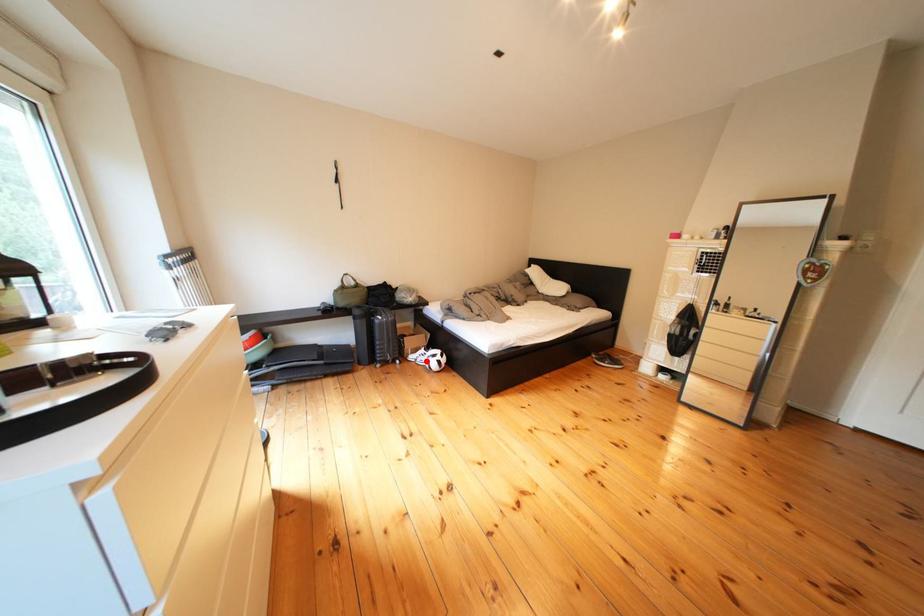
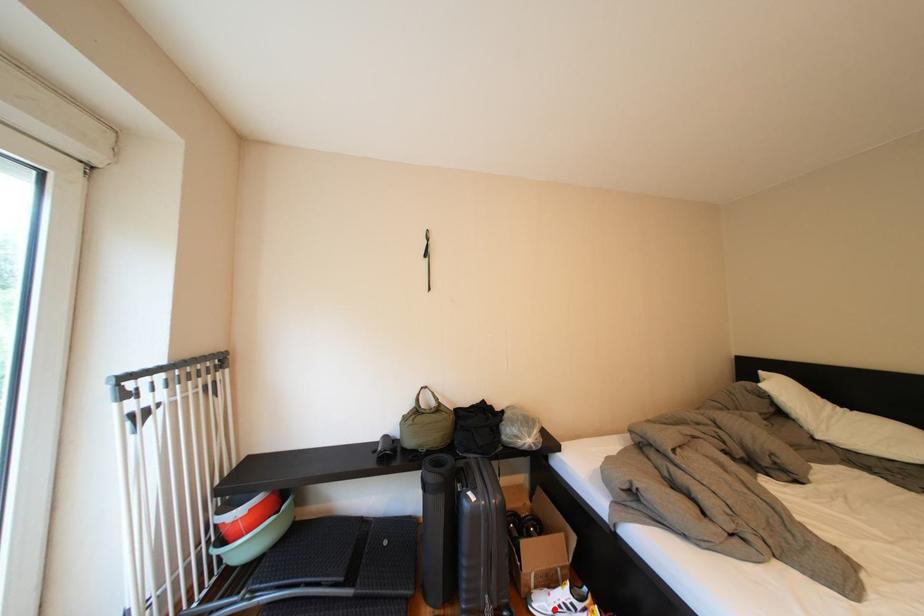
I am providing you with two images of the same scene from different viewpoints. A red point is marked on the first image and another point is marked on the second image. Do the highlighted points in image1 and image2 indicate the same real-world spot?

Yes